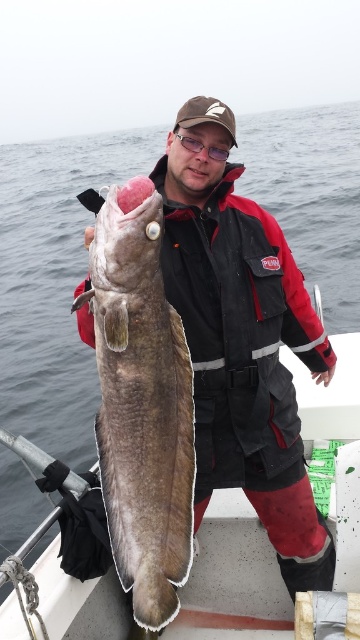
Question: Does black fabric jacket at center appear under smooth plastic boat at center?

Choices:
 (A) no
 (B) yes

Answer: (A)

Question: Where is black fabric jacket at center located in relation to dark gray textured fish at center in the image?

Choices:
 (A) above
 (B) below

Answer: (A)

Question: Which point appears farthest from the camera in this image?

Choices:
 (A) (106, 365)
 (B) (208, 113)
 (C) (272, 637)

Answer: (C)

Question: Can you confirm if black fabric jacket at center is positioned to the left of dark gray textured fish at center?

Choices:
 (A) yes
 (B) no

Answer: (B)

Question: Based on their relative distances, which object is farther from the black fabric jacket at center?

Choices:
 (A) smooth plastic boat at center
 (B) dark gray textured fish at center

Answer: (A)

Question: Among these objects, which one is farthest from the camera?

Choices:
 (A) dark gray textured fish at center
 (B) smooth plastic boat at center
 (C) black fabric jacket at center

Answer: (B)